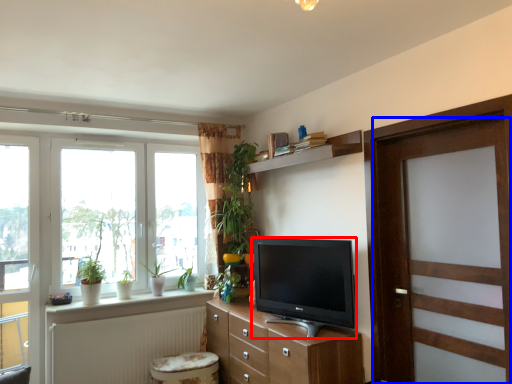
Question: Which point is further to the camera, television (highlighted by a red box) or door (highlighted by a blue box)?

Choices:
 (A) television
 (B) door

Answer: (A)